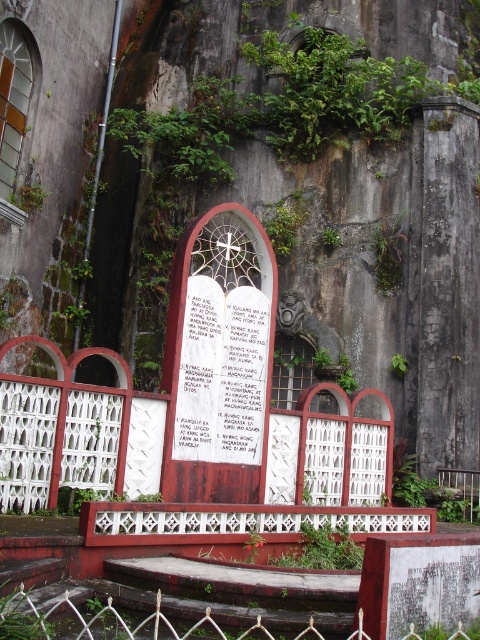
You are standing in front of the historic stone structure and want to place a new decorative item exactly at the center of the white paper located at point [222,372]. Given the description of the scene, can you confirm if this placement will be visible from the main entrance of the structure?

The point [222,372] marks the white paper at center, so placing the decorative item there would indeed be visible from the main entrance as it is centrally located.

You are an artist who wants to draw the scene in front of you. You notice the white paper at center and the white metal fence at lower center. Which object should you draw first if you want to follow the rule of drawing objects from top to bottom based on their vertical positions?

The white paper at center should be drawn first because it has a greater height compared to the white metal fence at lower center, meaning it is positioned higher up vertically.